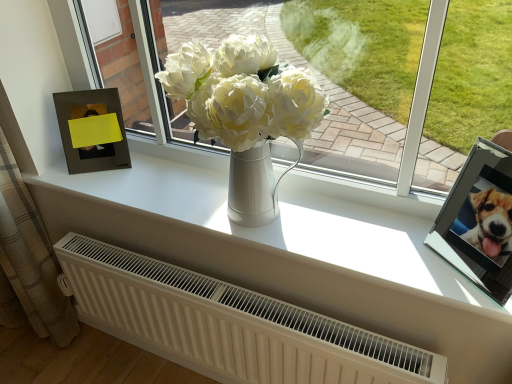
Question: Based on their sizes in the image, would you say white matte vase at center is bigger or smaller than matte brown picture frame at left, positioned as the second picture frame in right-to-left order?

Choices:
 (A) big
 (B) small

Answer: (A)

Question: Looking at their shapes, would you say white matte vase at center is wider or thinner than matte brown picture frame at left, acting as the 1th picture frame starting from the left?

Choices:
 (A) thin
 (B) wide

Answer: (B)

Question: Which object is positioned closest to the white matte vase at center?

Choices:
 (A) plaid fabric curtain at left
 (B) metallic silver picture frame at upper right, the 2th picture frame when ordered from left to right
 (C) white matte vase at center
 (D) matte brown picture frame at left, the 1th picture frame viewed from the back
 (E) white matte radiator at lower center

Answer: (E)

Question: Considering the real-world distances, which object is farthest from the plaid fabric curtain at left?

Choices:
 (A) white matte vase at center
 (B) white matte vase at center
 (C) metallic silver picture frame at upper right, the 1th picture frame in the right-to-left sequence
 (D) white matte radiator at lower center
 (E) matte brown picture frame at left, the 1th picture frame viewed from the back

Answer: (B)